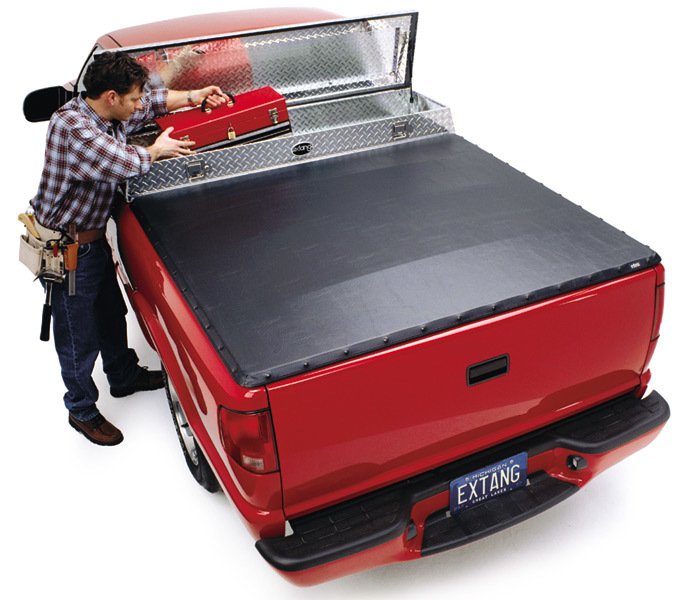
Image resolution: width=698 pixels, height=600 pixels. I want to click on doors, so click(81, 88), click(403, 412).